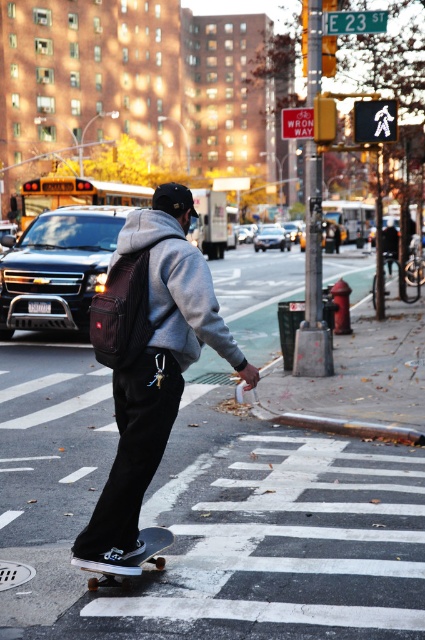
Between matte black backpack at center and black matte skateboard at lower center, which one appears on the left side from the viewer's perspective?

Positioned to the left is black matte skateboard at lower center.

Between matte black backpack at center and black matte skateboard at lower center, which one appears on the right side from the viewer's perspective?

matte black backpack at center

Is point (133, 500) closer to viewer compared to point (133, 563)?

Yes.

Locate an element on the screen. matte black backpack at center is located at coordinates tap(155, 400).

Who is more forward, (192, 257) or (147, 541)?

Point (192, 257) is more forward.

Is gray fleece sweatshirt at center thinner than black matte skateboard at lower center?

Incorrect, gray fleece sweatshirt at center's width is not less than black matte skateboard at lower center's.

What do you see at coordinates (187, 291) in the screenshot?
I see `gray fleece sweatshirt at center` at bounding box center [187, 291].

Locate an element on the screen. gray fleece sweatshirt at center is located at coordinates (187, 291).

Does point (93, 516) come in front of point (152, 307)?

That is False.

Is matte black backpack at center closer to camera compared to gray fleece sweatshirt at center?

No, matte black backpack at center is behind gray fleece sweatshirt at center.

The height and width of the screenshot is (640, 425). Describe the element at coordinates (155, 400) in the screenshot. I see `matte black backpack at center` at that location.

The height and width of the screenshot is (640, 425). I want to click on matte black backpack at center, so click(155, 400).